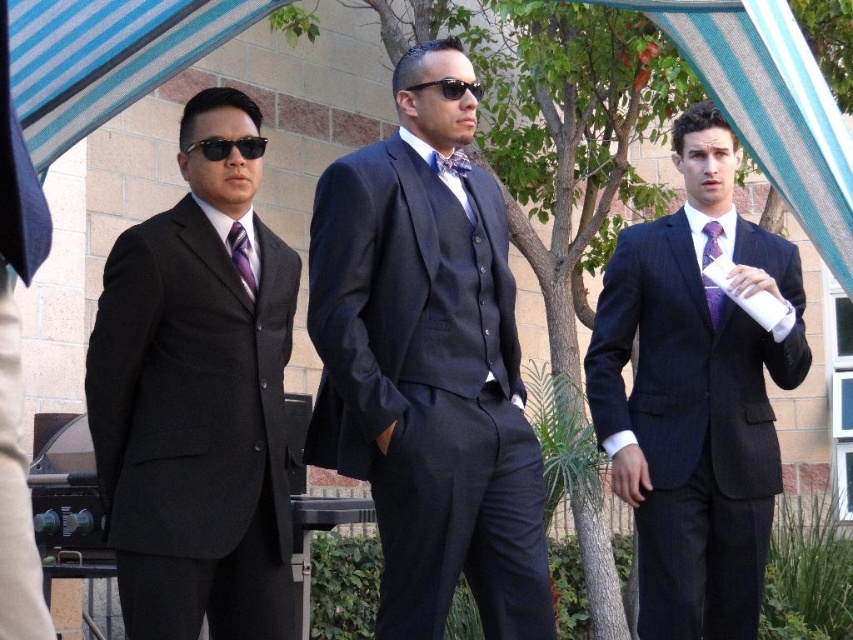
Which is more to the left, matte black suit at right or purple satin tie at right?

matte black suit at right is more to the left.

Does matte black suit at right appear on the right side of purple satin tie at right?

In fact, matte black suit at right is to the left of purple satin tie at right.

Who is more distant from viewer, [654,611] or [717,324]?

The point [717,324] is more distant.

This screenshot has width=853, height=640. I want to click on matte black suit at right, so click(695, 396).

Between black reflective sunglasses at left and purple satin tie at right, which one appears on the left side from the viewer's perspective?

From the viewer's perspective, black reflective sunglasses at left appears more on the left side.

From the picture: Between black reflective sunglasses at left and purple satin tie at right, which one has more height?

purple satin tie at right is taller.

Which is behind, point (212, 148) or point (706, 284)?

The point (706, 284) is behind.

The height and width of the screenshot is (640, 853). In order to click on black reflective sunglasses at left in this screenshot , I will do `click(228, 147)`.

Measure the distance from matte black suit at right to floral-patterned fabric tie at center.

They are 38.97 feet apart.

Between matte black suit at right and floral-patterned fabric tie at center, which one is positioned higher?

floral-patterned fabric tie at center is above.

Measure the distance between matte black suit at right and camera.

They are 34.76 meters apart.

Where is `matte black suit at right`? The height and width of the screenshot is (640, 853). matte black suit at right is located at coordinates (695, 396).